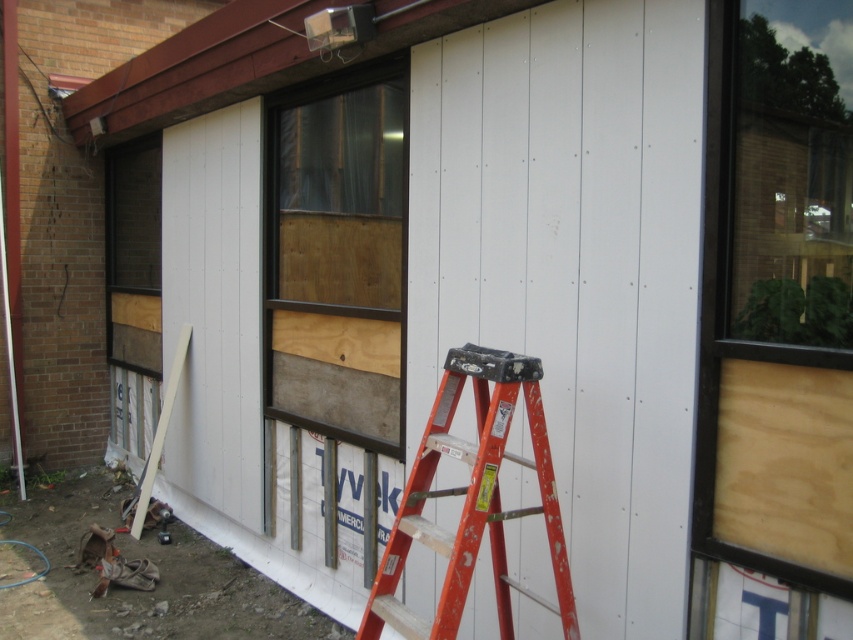
You are a painter who needs to reach the top of the white smooth siding at center. You have a metallic orange ladder at center available. Considering their heights, will the ladder reach the top of the siding?

The white smooth siding at center is taller than the metallic orange ladder at center, so the ladder will not reach the top of the siding.

You are an inspector checking the construction site. You notice the transparent glass window at upper right and the wooden paneling at left. Which object is shorter in height?

The transparent glass window at upper right has a lesser height compared to the wooden paneling at left, so the transparent glass window at upper right is shorter in height.

You are a contractor assessing the construction site. You need to determine which object is taller between the brown wood window at center and the wooden paneling at left. Based on the scene, which one is taller?

The brown wood window at center is taller than the wooden paneling at left according to the description.